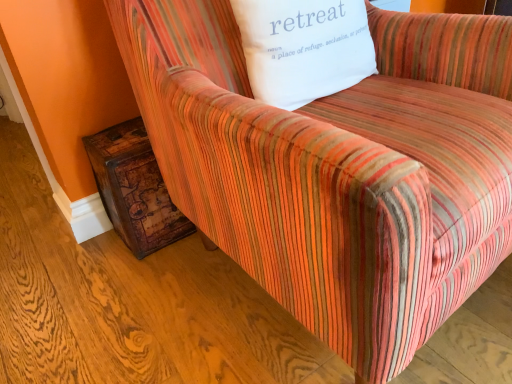
Where is `vacant area to the left of rustic wood side table at lower left`? vacant area to the left of rustic wood side table at lower left is located at coordinates (79, 251).